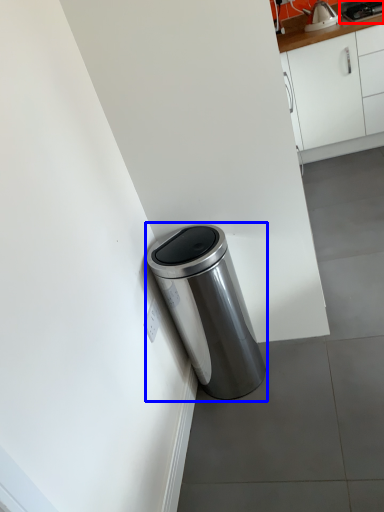
Question: Which of the following is the farthest to the observer, appliance (highlighted by a red box) or waste container (highlighted by a blue box)?

Choices:
 (A) appliance
 (B) waste container

Answer: (A)